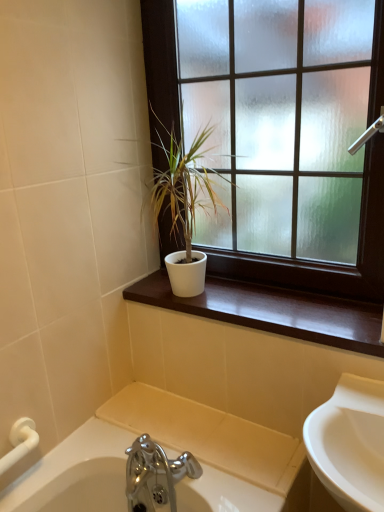
Question: Is point (233, 323) closer or farther from the camera than point (230, 262)?

Choices:
 (A) farther
 (B) closer

Answer: (B)

Question: Is white glossy window sill at center bigger or smaller than white matte window at upper center?

Choices:
 (A) big
 (B) small

Answer: (B)

Question: Based on their relative distances, which object is farther from the white matte window at upper center?

Choices:
 (A) white matte pot at center
 (B) white glossy window sill at center

Answer: (A)

Question: Which object is positioned farthest from the white matte pot at center?

Choices:
 (A) white glossy window sill at center
 (B) white matte window at upper center

Answer: (A)